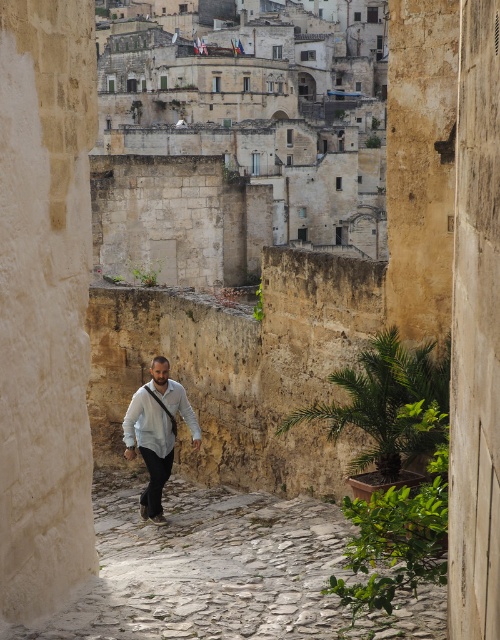
You are standing at the entrance of the alley and want to walk to the stone cobblestone path at center located at point (223, 572). Given that the alley is narrow, can you estimate if there is enough space for you to walk straight to that point without touching the walls?

The stone cobblestone path at center is located at point (223, 572), which is at the center of the alley. Since the alley is described as narrow but the path is centrally located, it is likely that there is sufficient space to walk straight to that point without touching the walls, assuming standard human width.

You are standing at the entrance of the alley and see two points marked in the image. The first point is at coordinates point (381, 6) and the second is at point (221, 611). If you want to walk towards the second point, which direction should you move relative to the first point?

To walk towards the second point at point (221, 611), you should move in the direction away from the first point at point (381, 6) since it is behind it.

Consider the image. You are a photographer aiming to capture the man in the alley. You notice two white shirts at the center of the image. Which shirt, the white matte shirt at center or the white cotton shirt at center, is visible on top?

The white matte shirt at center is positioned over white cotton shirt at center, so the white matte shirt at center is visible on top.